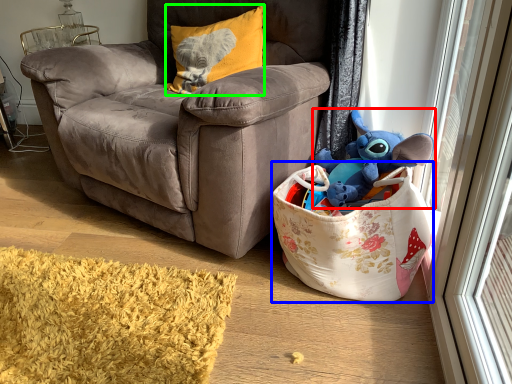
Question: Which object is positioned farthest from toy (highlighted by a red box)? Select from gift basket (highlighted by a blue box) and pillow (highlighted by a green box).

Choices:
 (A) gift basket
 (B) pillow

Answer: (B)